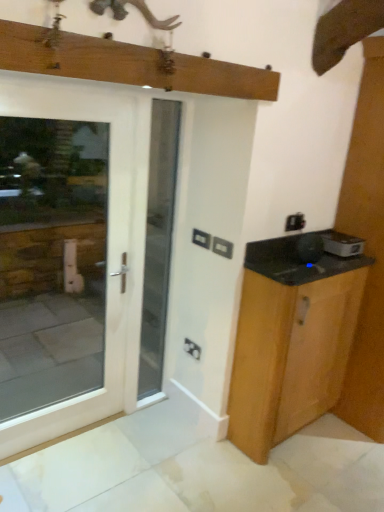
The image size is (384, 512). In order to click on vacant space situated above white wood door at left (from a real-world perspective) in this screenshot , I will do `click(64, 91)`.